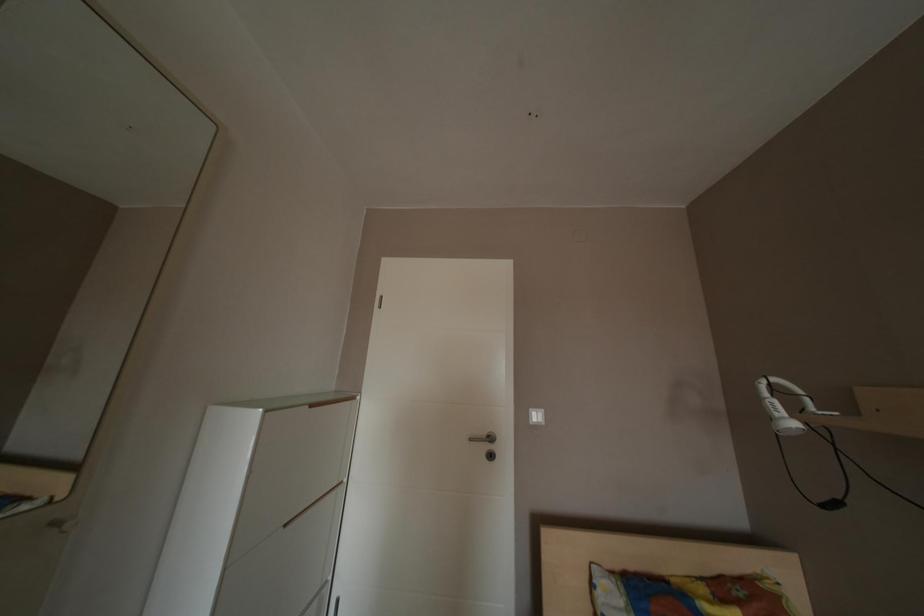
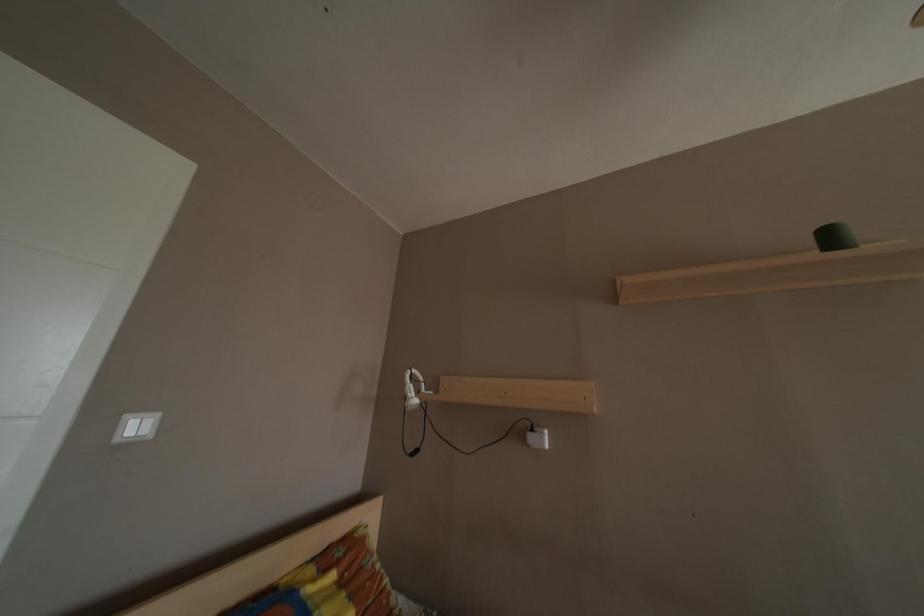
Question: Based on the continuous images, in which direction is the camera rotating? Reply with the corresponding letter.

Choices:
 (A) Left
 (B) Right
 (C) Up
 (D) Down

Answer: (B)